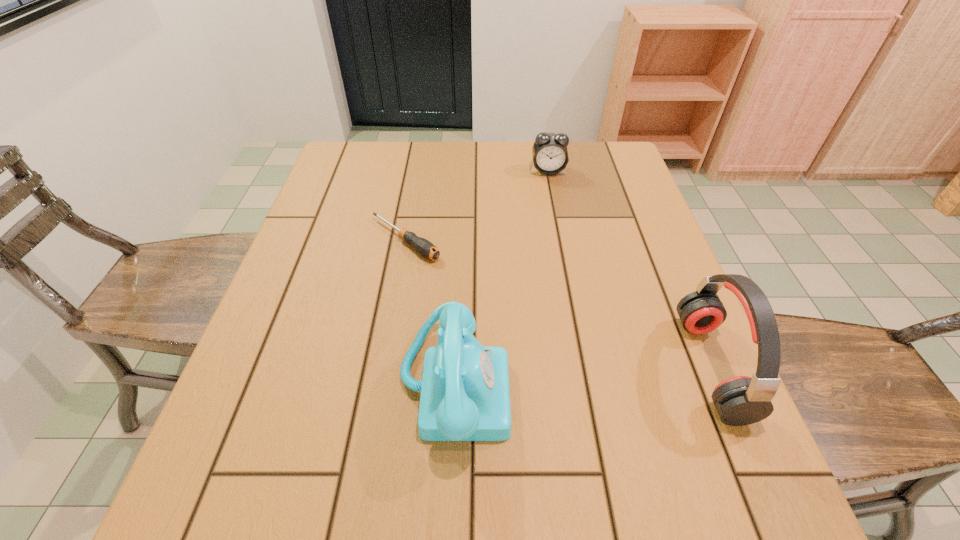
Where is `free space that satisfies the following two spatial constraints: 1. on the front side of the tallest object; 2. on the ear cups of the third object from left to right`? free space that satisfies the following two spatial constraints: 1. on the front side of the tallest object; 2. on the ear cups of the third object from left to right is located at coordinates (586, 367).

Find the location of a particular element. This screenshot has width=960, height=540. vacant area in the image that satisfies the following two spatial constraints: 1. on the front side of the second tallest object; 2. on the dial of the third nearest object is located at coordinates (379, 384).